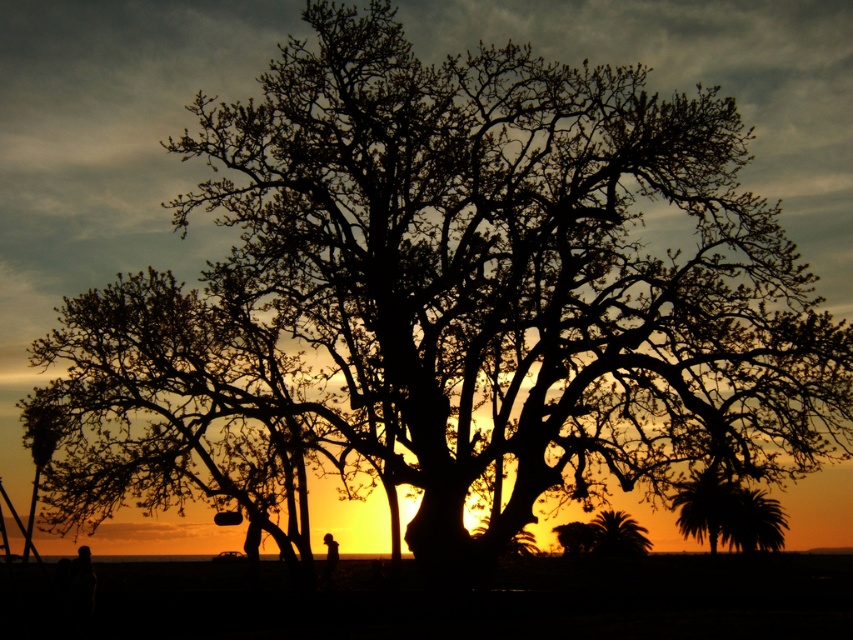
Question: Does green leafy palm at right have a lesser width compared to black matte person at lower center?

Choices:
 (A) yes
 (B) no

Answer: (B)

Question: Estimate the real-world distances between objects in this image. Which object is farther from the black silhouette person at center?

Choices:
 (A) black matte person at lower center
 (B) green leafy palm at right

Answer: (B)

Question: Which of the following is the closest to the observer?

Choices:
 (A) [717, 509]
 (B) [328, 550]

Answer: (B)

Question: Is black matte person at lower center in front of black silhouette person at center?

Choices:
 (A) no
 (B) yes

Answer: (B)

Question: Based on their relative distances, which object is farther from the black silhouette person at center?

Choices:
 (A) black matte person at lower center
 (B) green leafy palm at right

Answer: (B)

Question: Can you confirm if green leafy palm at right is positioned above black matte person at lower center?

Choices:
 (A) yes
 (B) no

Answer: (B)